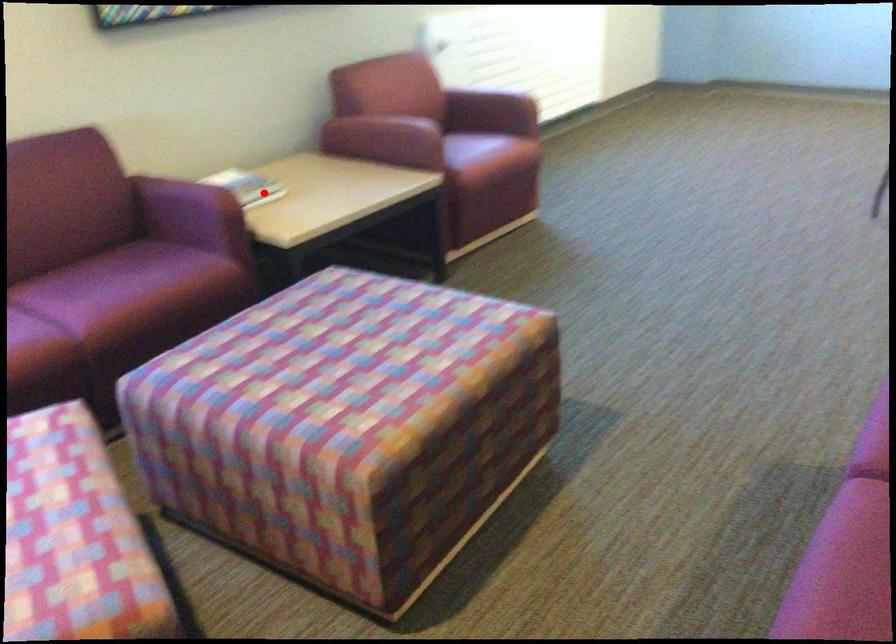
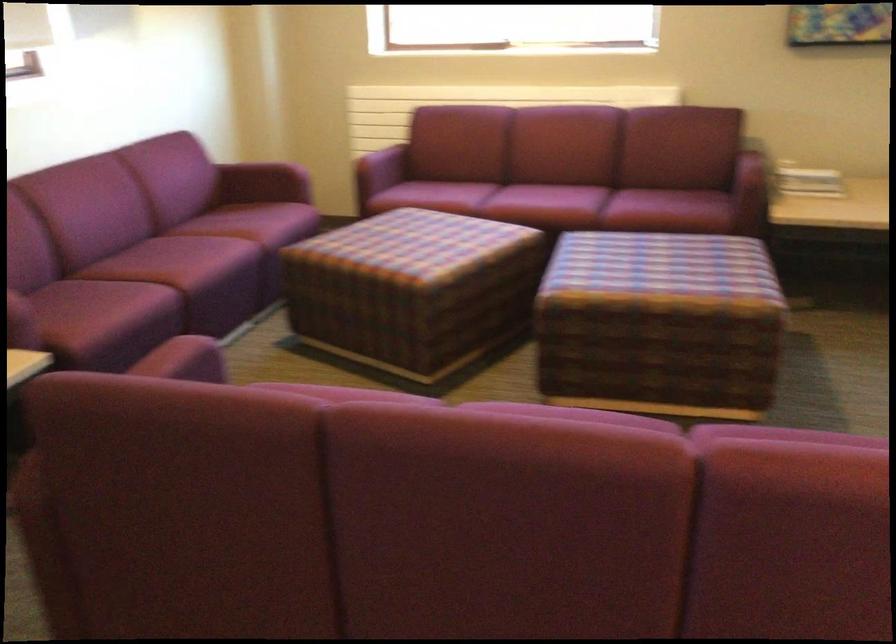
The point at the highlighted location is marked in the first image. Where is the corresponding point in the second image?

(807, 180)